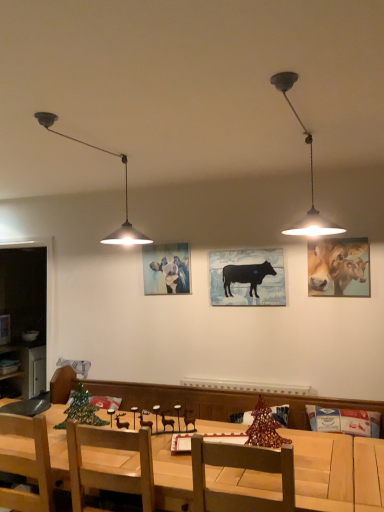
Locate an element on the screen. This screenshot has height=512, width=384. vacant space situated above metallic pendant light at upper right, the first lamp when ordered from right to left (from a real-world perspective) is located at coordinates (301, 116).